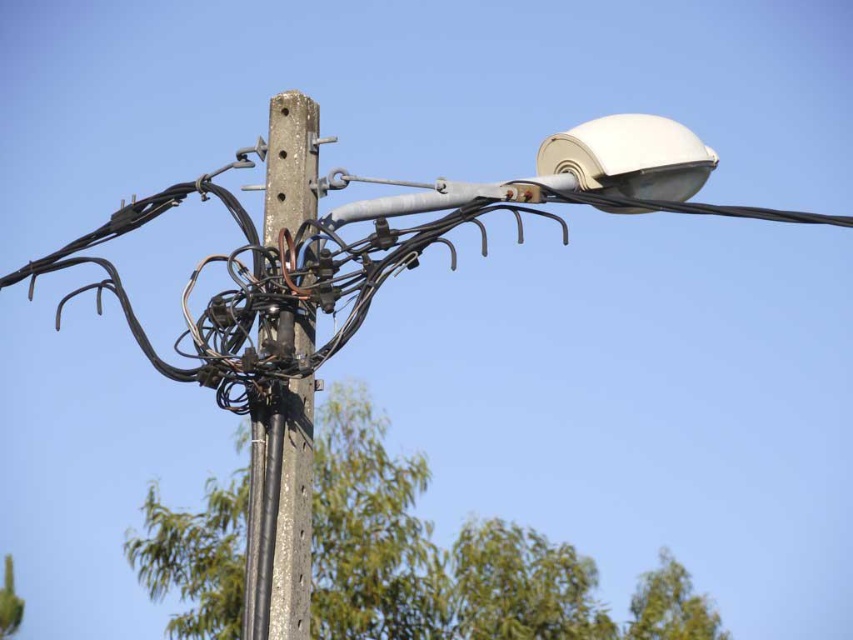
What do you see at coordinates (456, 560) in the screenshot? Image resolution: width=853 pixels, height=640 pixels. I see `green leafy tree at center` at bounding box center [456, 560].

Between green leafy tree at center and gray concrete telegraph pole at center, which one is positioned higher?

gray concrete telegraph pole at center is higher up.

Measure the distance between point (357, 420) and camera.

Point (357, 420) is 18.62 meters from camera.

I want to click on green leafy tree at center, so click(x=456, y=560).